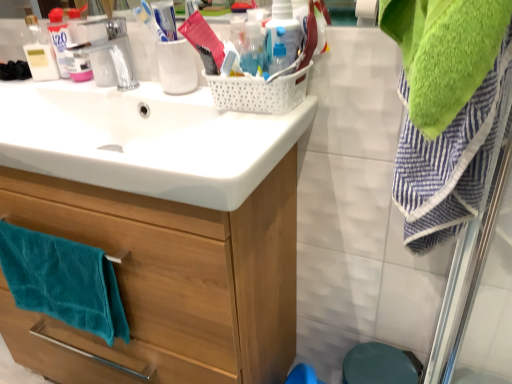
Question: Considering the relative sizes of teal soft towel at lower left and translucent plastic bottle at upper center, which is the first bottle in left-to-right order, in the image provided, is teal soft towel at lower left thinner than translucent plastic bottle at upper center, which is the first bottle in left-to-right order,?

Choices:
 (A) no
 (B) yes

Answer: (A)

Question: Is the depth of teal soft towel at lower left less than that of translucent plastic bottle at upper center, the second bottle viewed from the right?

Choices:
 (A) yes
 (B) no

Answer: (B)

Question: Considering the relative sizes of teal soft towel at lower left and translucent plastic bottle at upper center, which is the first bottle in left-to-right order, in the image provided, is teal soft towel at lower left bigger than translucent plastic bottle at upper center, which is the first bottle in left-to-right order,?

Choices:
 (A) yes
 (B) no

Answer: (A)

Question: Is teal soft towel at lower left next to translucent plastic bottle at upper center, the second bottle viewed from the right, and touching it?

Choices:
 (A) no
 (B) yes

Answer: (A)

Question: Is teal soft towel at lower left positioned behind translucent plastic bottle at upper center, the second bottle viewed from the right?

Choices:
 (A) no
 (B) yes

Answer: (B)

Question: Is wooden cabinet at center inside or outside of translucent plastic bottle at upper center, the 1th bottle from the right?

Choices:
 (A) inside
 (B) outside

Answer: (B)

Question: In terms of size, does wooden cabinet at center appear bigger or smaller than translucent plastic bottle at upper center, the 1th bottle from the right?

Choices:
 (A) small
 (B) big

Answer: (B)

Question: In terms of height, does wooden cabinet at center look taller or shorter compared to translucent plastic bottle at upper center, placed as the second bottle when sorted from left to right?

Choices:
 (A) short
 (B) tall

Answer: (B)

Question: From a real-world perspective, relative to translucent plastic bottle at upper center, the 1th bottle from the right, is wooden cabinet at center vertically above or below?

Choices:
 (A) below
 (B) above

Answer: (A)

Question: Is teal soft towel at lower left taller or shorter than translucent plastic bottle at upper center, which is the first bottle in left-to-right order?

Choices:
 (A) tall
 (B) short

Answer: (A)

Question: In the image, is teal soft towel at lower left positioned in front of or behind translucent plastic bottle at upper center, which is the first bottle in left-to-right order?

Choices:
 (A) front
 (B) behind

Answer: (B)

Question: Is teal soft towel at lower left bigger or smaller than translucent plastic bottle at upper center, which is the first bottle in left-to-right order?

Choices:
 (A) small
 (B) big

Answer: (B)

Question: Considering the positions of point (100, 291) and point (260, 36), is point (100, 291) closer or farther from the camera than point (260, 36)?

Choices:
 (A) farther
 (B) closer

Answer: (A)

Question: Is translucent plastic bottle at upper center, which is the first bottle in left-to-right order, wider or thinner than teal soft towel at lower left?

Choices:
 (A) wide
 (B) thin

Answer: (B)

Question: From their relative heights in the image, would you say translucent plastic bottle at upper center, the second bottle viewed from the right, is taller or shorter than teal soft towel at lower left?

Choices:
 (A) tall
 (B) short

Answer: (B)